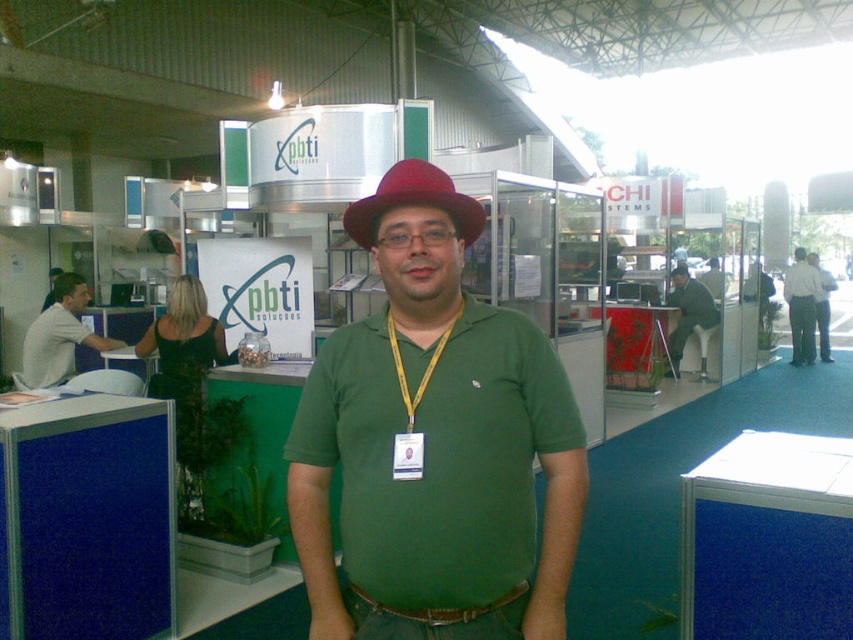
Question: Does white shirt at center have a lesser width compared to matte red hat at center?

Choices:
 (A) yes
 (B) no

Answer: (B)

Question: Which object appears closest to the camera in this image?

Choices:
 (A) matte red hat at center
 (B) green fabric shirt at center

Answer: (B)

Question: Does green fabric shirt at center appear on the left side of matte red hat at center?

Choices:
 (A) no
 (B) yes

Answer: (B)

Question: Where is light gray shirt at left located in relation to white shirt at right in the image?

Choices:
 (A) right
 (B) left

Answer: (B)

Question: Which point appears closest to the camera in this image?

Choices:
 (A) (682, 276)
 (B) (822, 323)

Answer: (A)

Question: Among these points, which one is nearest to the camera?

Choices:
 (A) (57, 312)
 (B) (798, 353)
 (C) (704, 333)

Answer: (A)